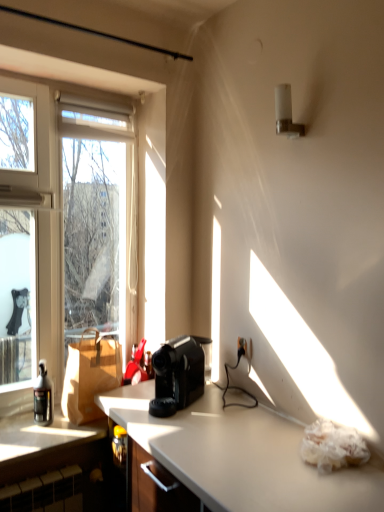
Question: Is the depth of brown paper bag at left greater than that of transparent glass window at left?

Choices:
 (A) yes
 (B) no

Answer: (A)

Question: Would you say brown paper bag at left contains transparent glass window at left?

Choices:
 (A) yes
 (B) no

Answer: (B)

Question: Can you confirm if brown paper bag at left is wider than transparent glass window at left?

Choices:
 (A) yes
 (B) no

Answer: (A)

Question: From a real-world perspective, is brown paper bag at left located beneath transparent glass window at left?

Choices:
 (A) yes
 (B) no

Answer: (A)

Question: Is the surface of brown paper bag at left in direct contact with transparent glass window at left?

Choices:
 (A) no
 (B) yes

Answer: (A)

Question: From the image's perspective, relative to transparent glass window at left, is translucent glass bottle at left above or below?

Choices:
 (A) below
 (B) above

Answer: (A)

Question: Looking at their shapes, would you say translucent glass bottle at left is wider or thinner than transparent glass window at left?

Choices:
 (A) thin
 (B) wide

Answer: (B)

Question: Relative to transparent glass window at left, is translucent glass bottle at left in front or behind?

Choices:
 (A) front
 (B) behind

Answer: (B)

Question: Looking at the image, does translucent glass bottle at left seem bigger or smaller compared to transparent glass window at left?

Choices:
 (A) small
 (B) big

Answer: (A)

Question: In terms of height, does black plastic coffee maker at center look taller or shorter compared to metallic silver cabinet at left?

Choices:
 (A) tall
 (B) short

Answer: (A)

Question: From a real-world perspective, relative to metallic silver cabinet at left, is black plastic coffee maker at center vertically above or below?

Choices:
 (A) above
 (B) below

Answer: (A)

Question: Looking at their shapes, would you say black plastic coffee maker at center is wider or thinner than metallic silver cabinet at left?

Choices:
 (A) thin
 (B) wide

Answer: (B)

Question: In terms of size, does black plastic coffee maker at center appear bigger or smaller than metallic silver cabinet at left?

Choices:
 (A) big
 (B) small

Answer: (A)

Question: Considering the positions of brown paper bag at left and metallic silver cabinet at left in the image, is brown paper bag at left wider or thinner than metallic silver cabinet at left?

Choices:
 (A) thin
 (B) wide

Answer: (A)

Question: From their relative heights in the image, would you say brown paper bag at left is taller or shorter than metallic silver cabinet at left?

Choices:
 (A) short
 (B) tall

Answer: (B)